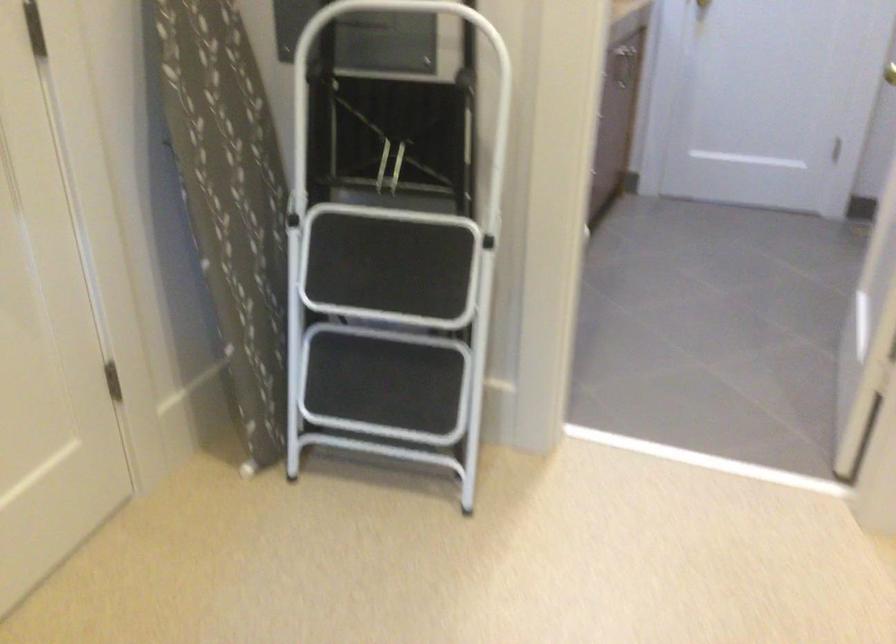
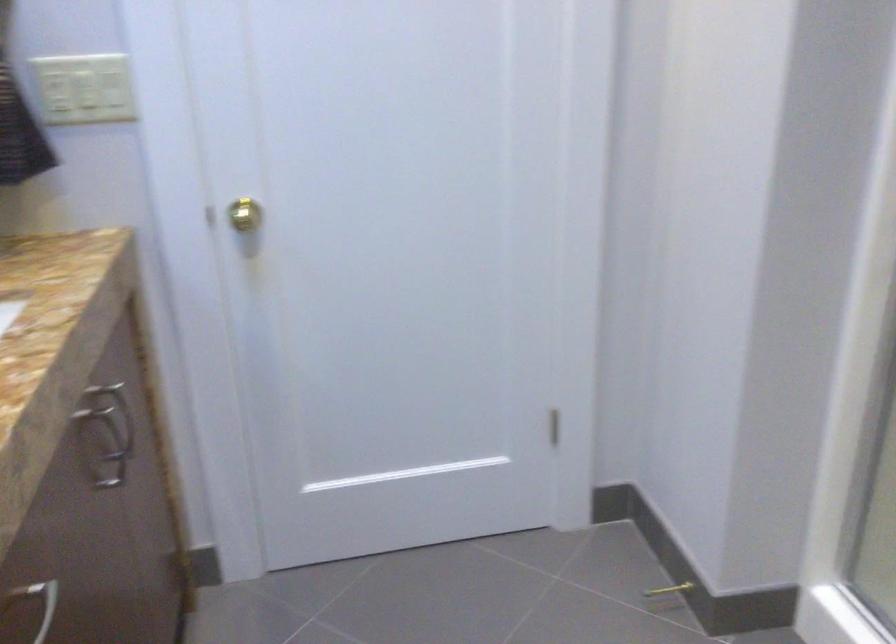
The point at (623, 77) is marked in the first image. Where is the corresponding point in the second image?

(113, 453)